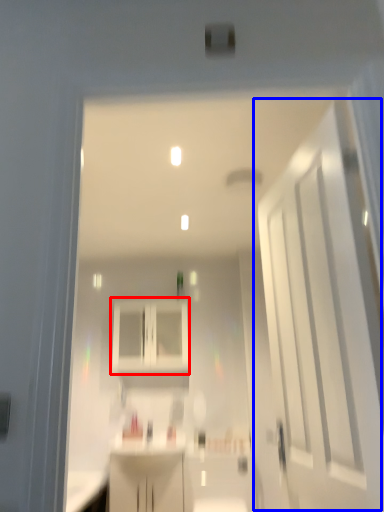
Question: Which of the following is the farthest to the observer, cabinetry (highlighted by a red box) or door (highlighted by a blue box)?

Choices:
 (A) cabinetry
 (B) door

Answer: (A)